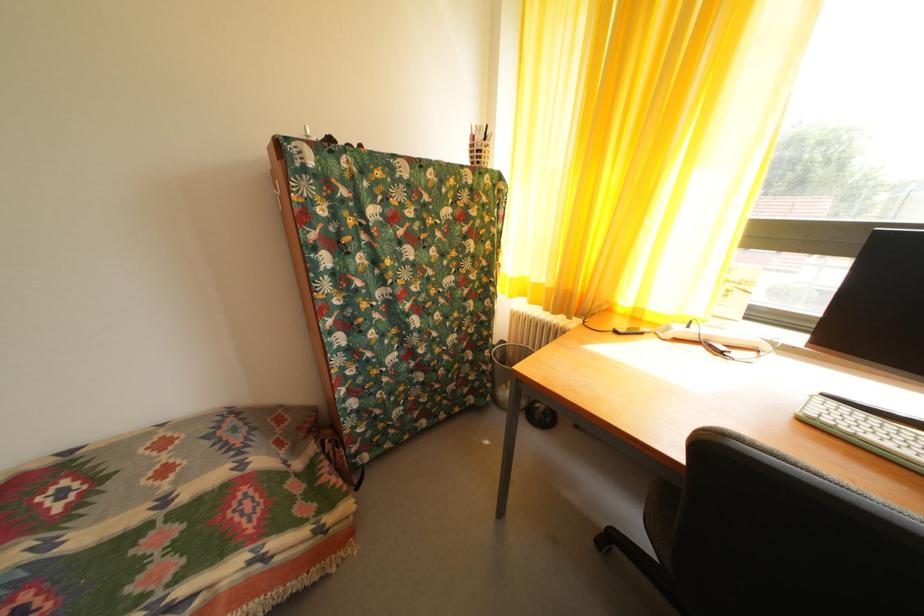
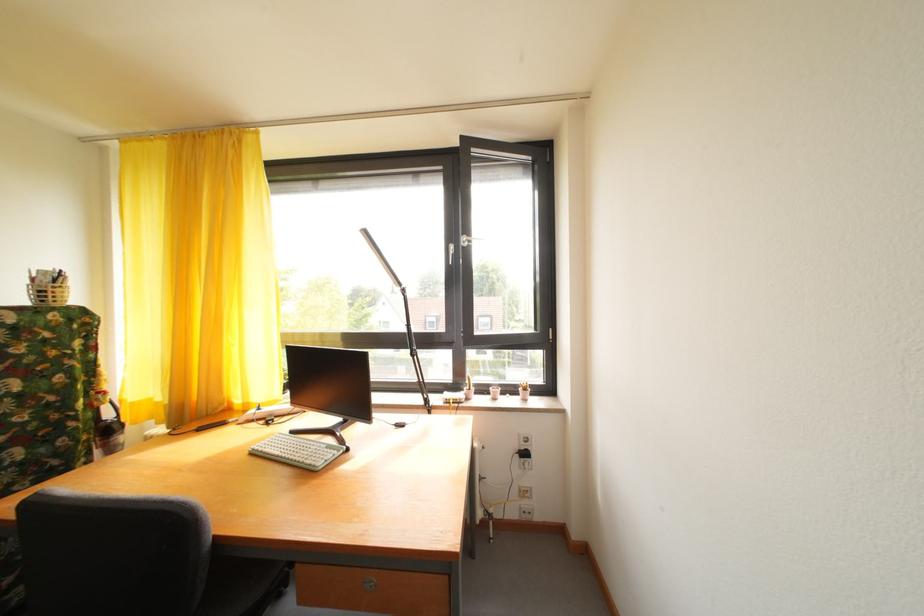
Locate, in the second image, the point that corresponds to pixel 833 403 in the first image.

(301, 438)